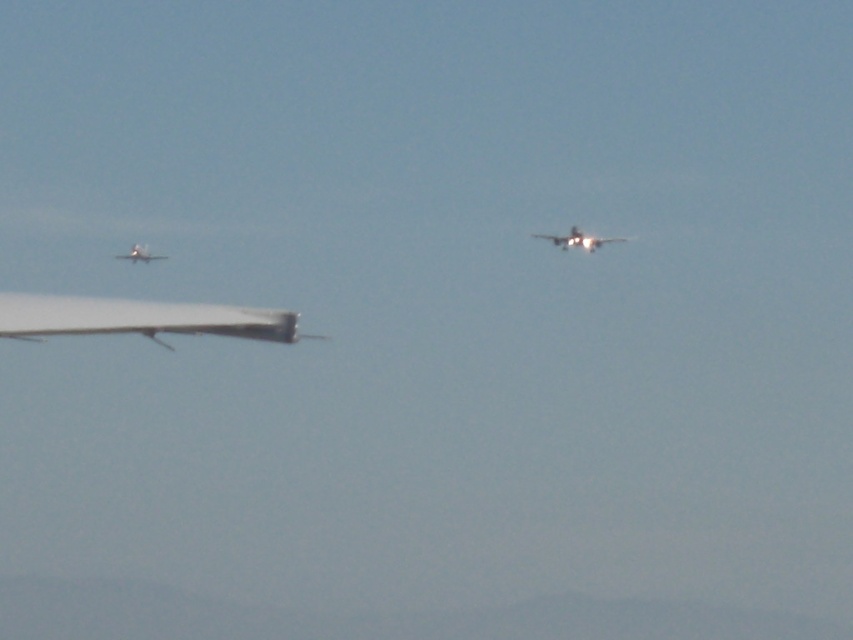
You are a pilot flying towards the metallic silver airplane at left and the shiny silver airplane at center. Which airplane should you adjust your course to avoid collision?

You should adjust your course to avoid the metallic silver airplane at left because the shiny silver airplane at center is positioned on the right side of it, meaning the metallic silver airplane at left is closer to your current path.

You are a pilot in a small aircraft observing two planes in the sky. You see a white matte airplane at left and a metallic silver airplane at left. Given that your aircraft has a wingspan of 32 feet, can you safely pass between them without colliding?

The distance between the white matte airplane at left and the metallic silver airplane at left is 76.36 feet. Since your aircraft has a wingspan of 32 feet, there is sufficient space to safely pass between them as the distance is greater than the wingspan.

You are a pilot flying an airplane and want to know the distance between your current position and the point marked at coordinates point (x=137, y=305). Can you determine this distance using the information provided?

The distance between point (x=137, y=305) and the camera is 75.84 feet. Since you are the pilot and the camera is likely positioned at your current location, the distance between your current position and the point marked at coordinates point (x=137, y=305) is 75.84 feet.